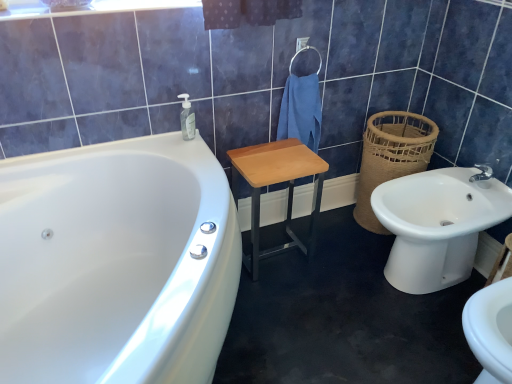
Identify the location of vacant space underneath wooden/matte step stool at center (from a real-world perspective). The width and height of the screenshot is (512, 384). (275, 254).